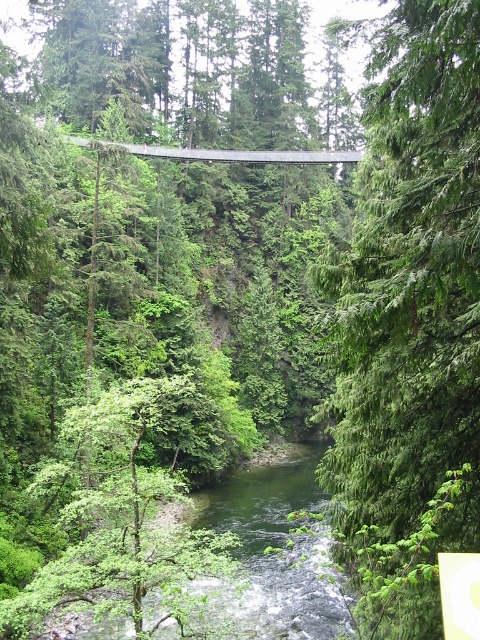
Question: Can you confirm if green matte tree at upper center is positioned above green leafy stream at center?

Choices:
 (A) no
 (B) yes

Answer: (B)

Question: Is green matte tree at upper center smaller than green leafy stream at center?

Choices:
 (A) no
 (B) yes

Answer: (B)

Question: Among these objects, which one is nearest to the camera?

Choices:
 (A) green leafy stream at center
 (B) green matte tree at upper center

Answer: (B)

Question: Which point is farther to the camera?

Choices:
 (A) green matte tree at upper center
 (B) green leafy stream at center

Answer: (B)

Question: Can you confirm if green matte tree at upper center is positioned to the left of green leafy stream at center?

Choices:
 (A) yes
 (B) no

Answer: (B)